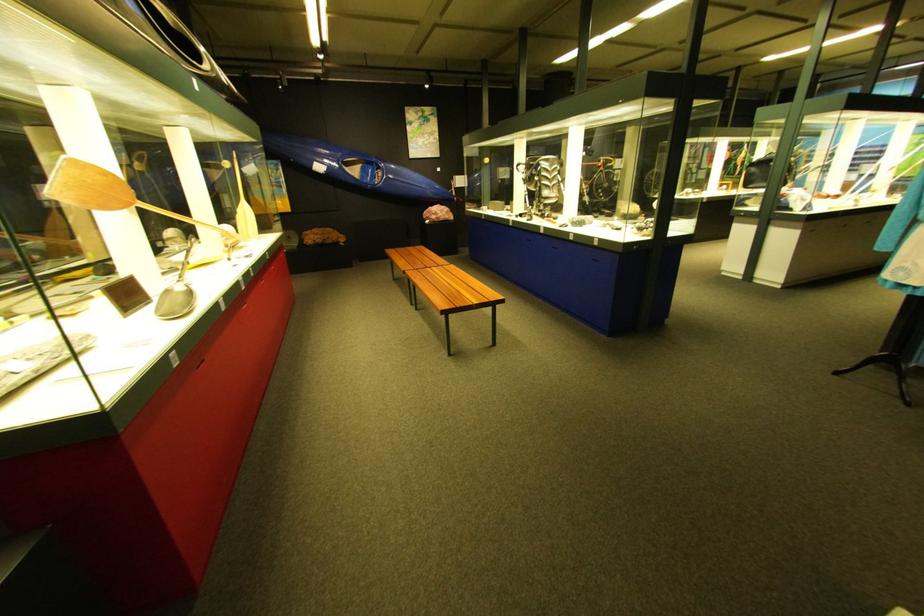
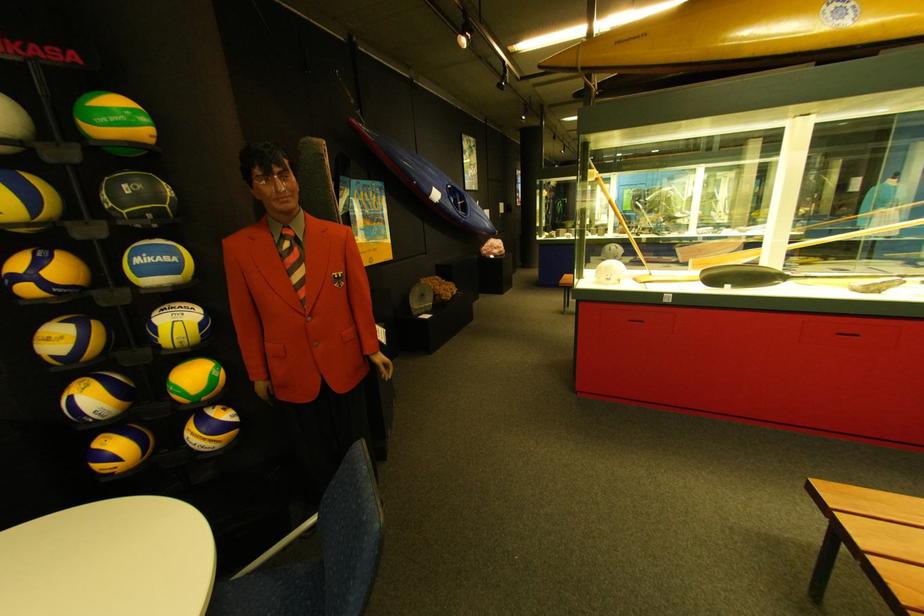
In the second image, find the point that corresponds to point 305,238 in the first image.

(438, 297)